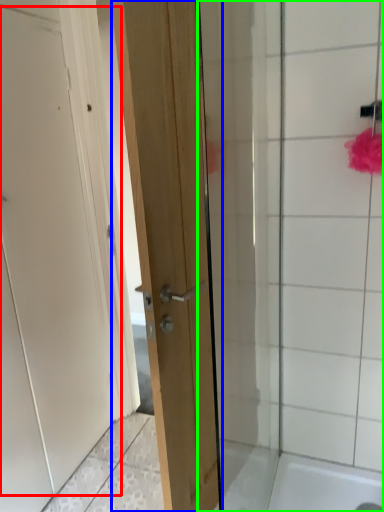
Question: Which object is the closest to the door (highlighted by a red box)? Choose among these: door (highlighted by a blue box) or shower door (highlighted by a green box).

Choices:
 (A) door
 (B) shower door

Answer: (A)